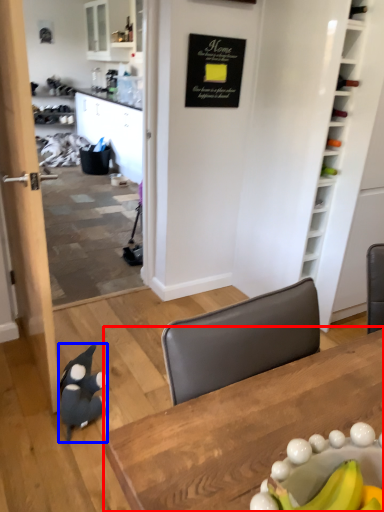
Question: Which object is further to the camera taking this photo, table (highlighted by a red box) or penguin (highlighted by a blue box)?

Choices:
 (A) table
 (B) penguin

Answer: (B)